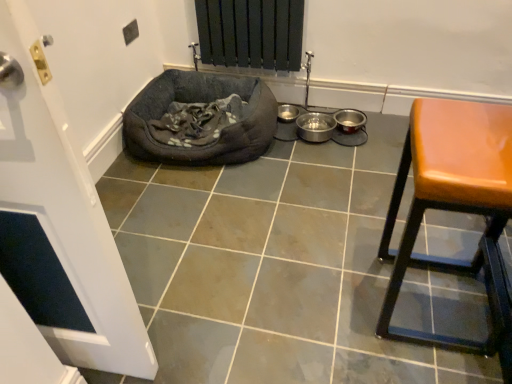
The width and height of the screenshot is (512, 384). In order to click on free point behind leatherette stool at right in this screenshot , I will do `click(384, 230)`.